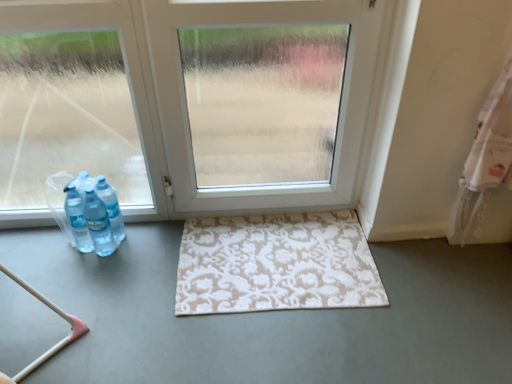
Identify the location of vacant area situated to the left side of beige patterned rug at center. (117, 292).